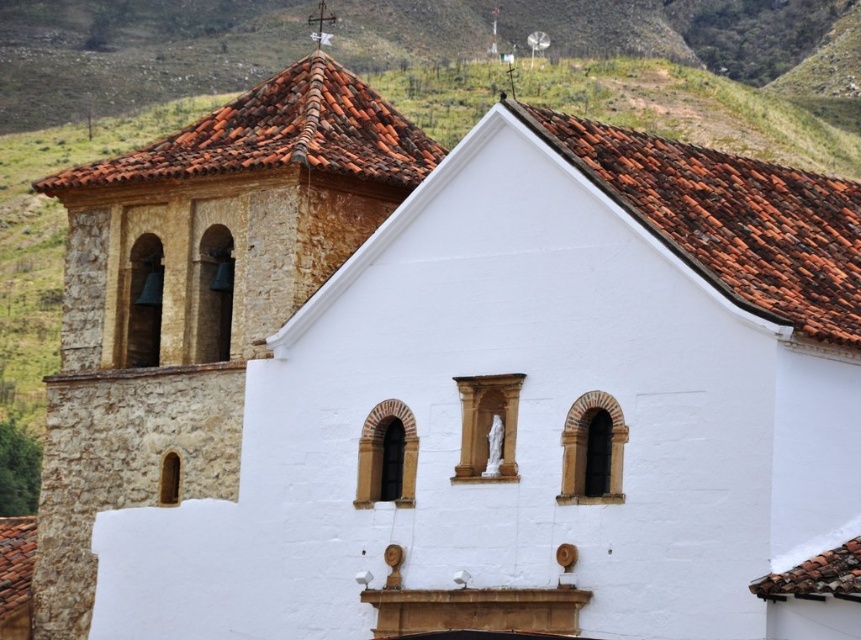
Who is taller, brown clay tiles at upper center or terracotta tiles at upper center?

brown clay tiles at upper center is taller.

Between point (259, 102) and point (505, 106), which one is positioned in front?

Positioned in front is point (505, 106).

What do you see at coordinates (729, 218) in the screenshot? The image size is (861, 640). I see `brown clay tiles at upper center` at bounding box center [729, 218].

This screenshot has height=640, width=861. Identify the location of brown clay tiles at upper center. (729, 218).

Is point (711, 216) in front of point (239, 164)?

Yes, point (711, 216) is closer to viewer.

What do you see at coordinates (729, 218) in the screenshot? I see `brown clay tiles at upper center` at bounding box center [729, 218].

Is point (46, 176) farther from viewer compared to point (369, 172)?

Yes, point (46, 176) is farther from viewer.

You are a GUI agent. You are given a task and a screenshot of the screen. Output one action in this format:
    pyautogui.click(x=<x>, y=<y>)
    Task: Click on the brown clay tiles at upper center
    
    Given the screenshot: What is the action you would take?
    pyautogui.click(x=729, y=218)

Can you confirm if terracotta tiles at upper center is positioned to the left of terracotta tiles at upper left?

No, terracotta tiles at upper center is not to the left of terracotta tiles at upper left.

Between terracotta tiles at upper center and terracotta tiles at upper left, which one appears on the left side from the viewer's perspective?

Positioned to the left is terracotta tiles at upper left.

The height and width of the screenshot is (640, 861). What are the coordinates of `terracotta tiles at upper center` in the screenshot? It's located at (729, 220).